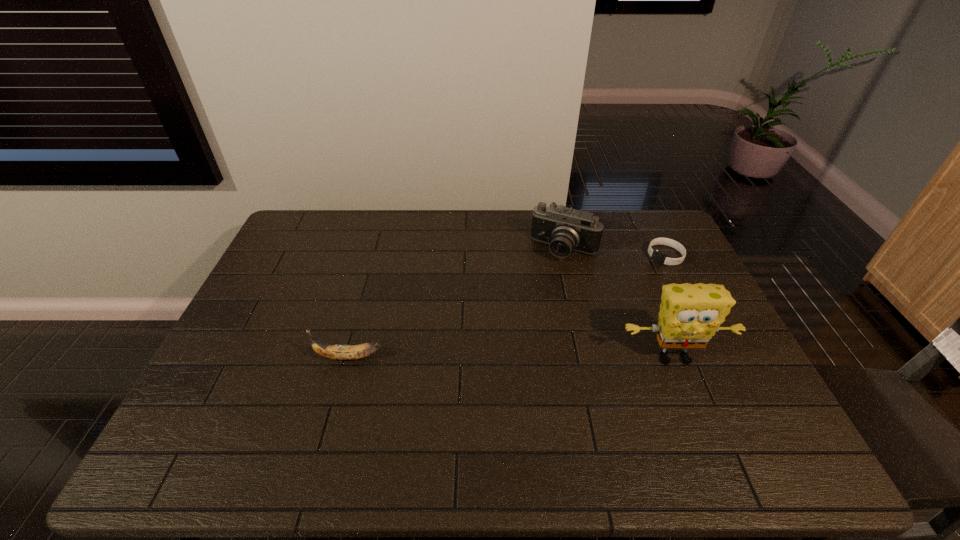
Locate an element on the screen. This screenshot has width=960, height=540. free space on the desktop that is between the third tallest object and the tallest object and is positioned on the front-facing side of the second tallest object is located at coordinates (513, 357).

The height and width of the screenshot is (540, 960). I want to click on vacant space on the desktop that is between the third tallest object and the sponge and is positioned on the outer surface of the wristband, so tap(547, 357).